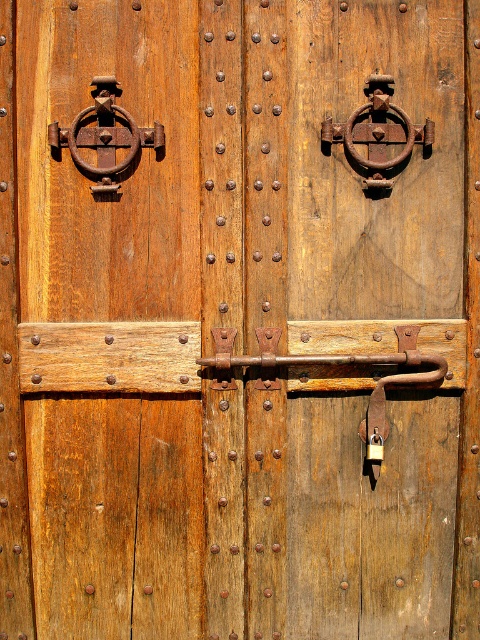
From the picture: Measure the distance between rustic wood knocker at upper left and rusty metal ring at upper center.

rustic wood knocker at upper left and rusty metal ring at upper center are 14.30 inches apart from each other.

The height and width of the screenshot is (640, 480). What are the coordinates of `rustic wood knocker at upper left` in the screenshot? It's located at (120, 176).

The image size is (480, 640). What do you see at coordinates (377, 132) in the screenshot? I see `rusty metal ring at upper center` at bounding box center [377, 132].

Between rusty metal ring at upper center and rusty metal ring at upper left, which one is positioned higher?

rusty metal ring at upper center

Does point (330, 144) lie behind point (110, 182)?

Yes, point (330, 144) is farther from viewer.

Where is `rusty metal ring at upper center`? This screenshot has height=640, width=480. rusty metal ring at upper center is located at coordinates (377, 132).

Which of these two, rustic wood knocker at upper left or rusty metal ring at upper left, stands shorter?

With less height is rusty metal ring at upper left.

Who is lower down, rustic wood knocker at upper left or rusty metal ring at upper left?

rustic wood knocker at upper left

Where is `rustic wood knocker at upper left`? rustic wood knocker at upper left is located at coordinates (120, 176).

Image resolution: width=480 pixels, height=640 pixels. I want to click on rustic wood knocker at upper left, so click(120, 176).